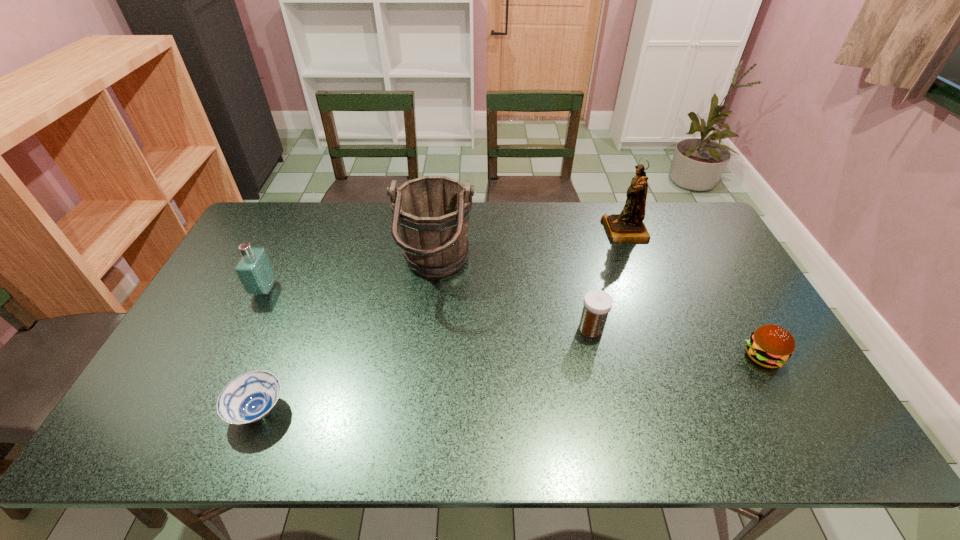
Where is `vacant area that lies between the perfume and the second object from left to right`? Image resolution: width=960 pixels, height=540 pixels. vacant area that lies between the perfume and the second object from left to right is located at coordinates (261, 350).

Where is `free spot between the fourth tallest object and the bucket`? The width and height of the screenshot is (960, 540). free spot between the fourth tallest object and the bucket is located at coordinates (514, 299).

Where is `empty space that is in between the nearest object and the bucket`? empty space that is in between the nearest object and the bucket is located at coordinates (347, 340).

Where is `vacant space that's between the figurine and the third shortest object`? This screenshot has width=960, height=540. vacant space that's between the figurine and the third shortest object is located at coordinates (608, 280).

Locate an element on the screen. The image size is (960, 540). empty space between the figurine and the fourth tallest object is located at coordinates (608, 280).

The width and height of the screenshot is (960, 540). Identify the location of vacant space that's between the shortest object and the medicine. (424, 369).

Locate an element on the screen. The height and width of the screenshot is (540, 960). unoccupied position between the shortest object and the rightmost object is located at coordinates (511, 383).

Find the location of a particular element. the second closest object relative to the nearest object is located at coordinates (431, 213).

Locate an element on the screen. The height and width of the screenshot is (540, 960). object that is the fourth closest to the fifth object from left to right is located at coordinates (250, 397).

Find the location of a particular element. The width and height of the screenshot is (960, 540). blank space that satisfies the following two spatial constraints: 1. on the front-facing side of the figurine; 2. on the left side of the rightmost object is located at coordinates (673, 356).